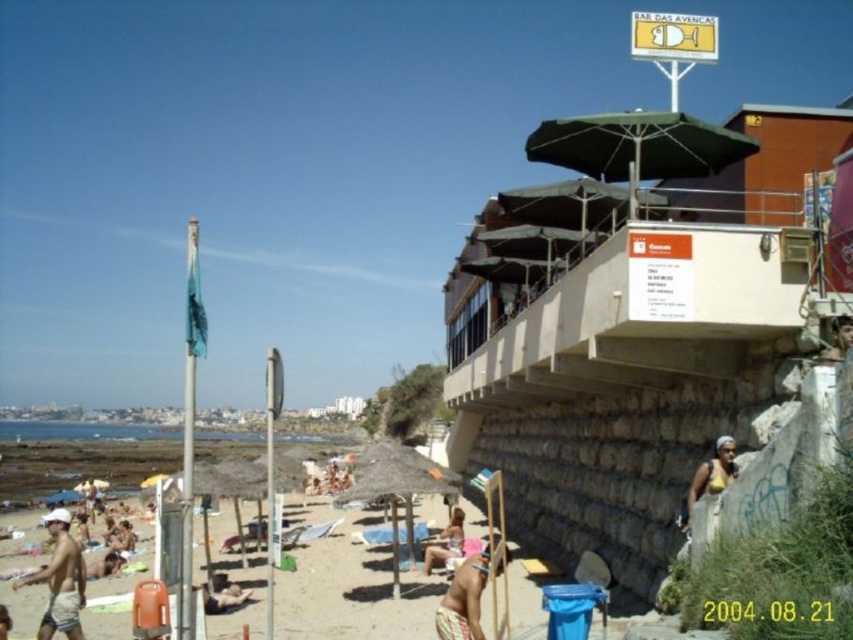
You are a photographer trying to capture the flagpole with the blue flag near the left side of the frame and the green fabric umbrella at upper right in the same shot. Based on their positions, which object should you adjust your camera to focus on first to ensure both are in the frame?

The green fabric umbrella at upper right is located at point (637, 147), so you should focus on it first to ensure both the flagpole and the umbrella are within the camera frame.

You are a photographer trying to capture a wide shot of the beach scene. You notice two people, the tan skin person at center and the tan skin person at beach center. Which of these two people appears wider in the photo?

The tan skin person at center appears wider than the tan skin person at beach center in the photo.

You are standing at the origin point of the beach scene. Based on the coordinates provided, in which direction should you walk to reach the tan skin person at center?

The tan skin person at center is located at coordinates approximately 0.847 on the x axis and 0.524 on the y axis. Since the origin is at the bottom left corner, you should walk northeast to reach them.